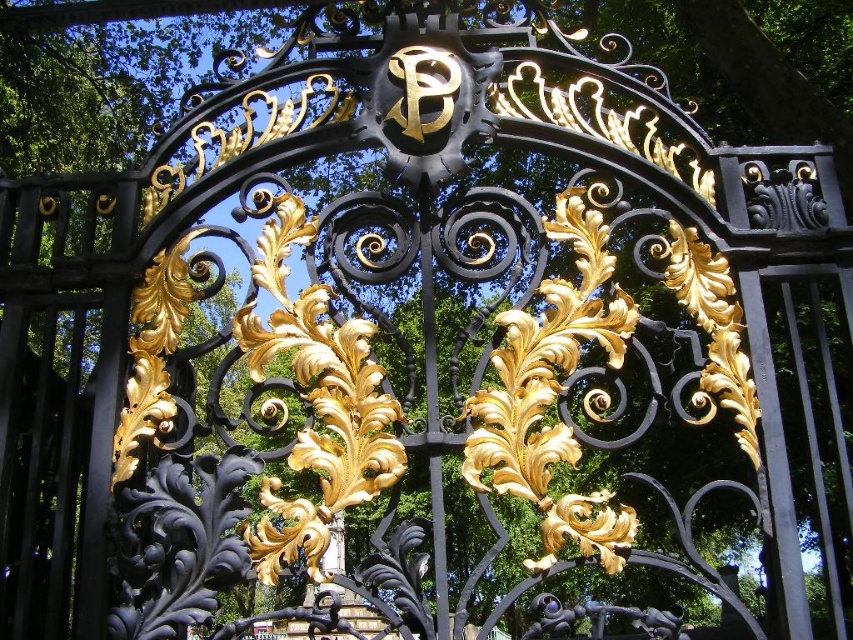
You are a painter standing in front of the ornate wrought iron gate. You need to touch both the glossy gold leaf at center and the gold leaf design at center with your brush. Which one do you need to reach higher to touch?

The glossy gold leaf at center is much taller than the gold leaf design at center, so you need to reach higher to touch the glossy gold leaf at center.

You are standing in front of the ornate wrought iron gate. There is a point marked at coordinates (x=553, y=394). What object is located at this point?

The point at coordinates (x=553, y=394) indicates the gold leafy ornament at center.

You are a painter standing in front of the ornate wrought iron gate. You notice two golden elements at the center of the gate. Which one is closer to you, the gold leafy ornament at center or the glossy gold leaf at center?

The gold leafy ornament at center is closer to you because it is in front of the glossy gold leaf at center.